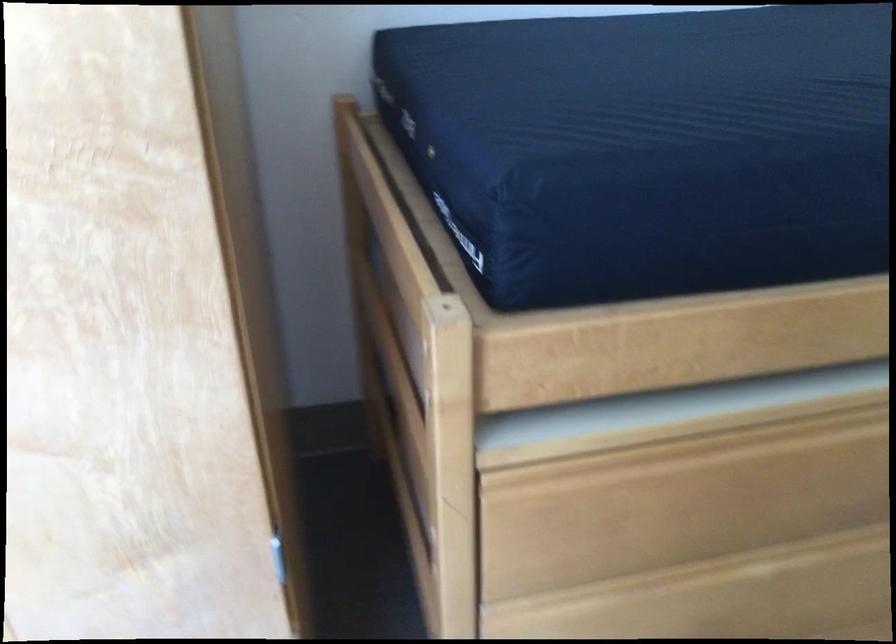
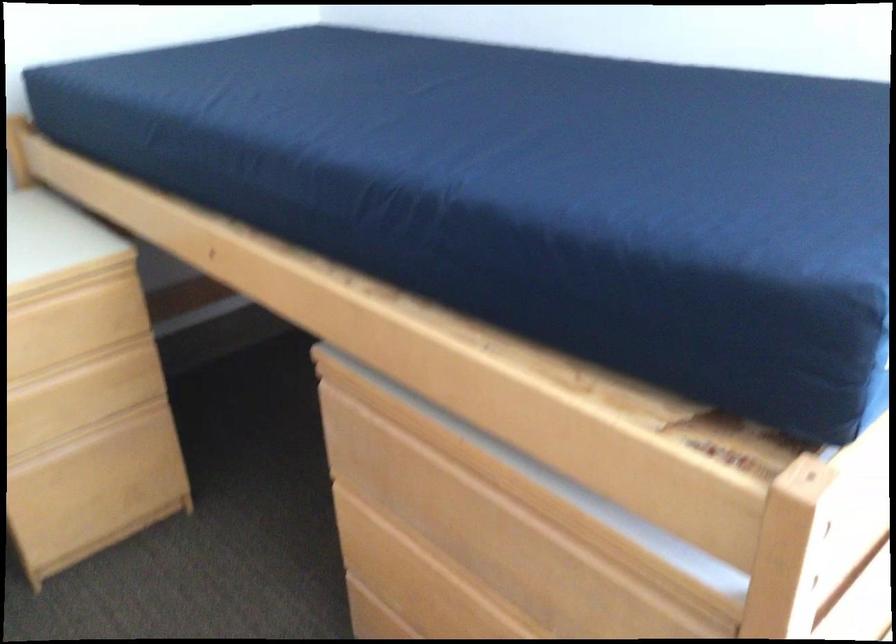
From the picture: First-person continuous shooting, in which direction is the camera rotating?

The camera rotated toward right-down.